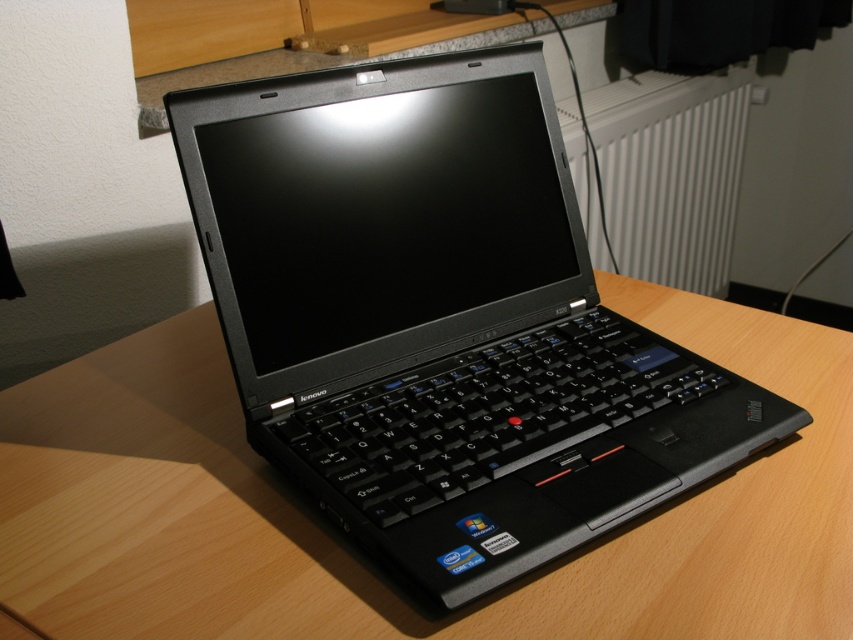
Question: Considering the relative positions of black plastic laptop at center and white plastic radiator at upper center in the image provided, where is black plastic laptop at center located with respect to white plastic radiator at upper center?

Choices:
 (A) left
 (B) right

Answer: (A)

Question: Is wooden table at center wider than white plastic radiator at upper center?

Choices:
 (A) no
 (B) yes

Answer: (B)

Question: Which point is closer to the camera?

Choices:
 (A) wooden table at center
 (B) black plastic laptop at center
 (C) white plastic radiator at upper center

Answer: (B)

Question: Which point is closer to the camera taking this photo?

Choices:
 (A) (558, 289)
 (B) (113, 392)

Answer: (B)

Question: Which point is closer to the camera?

Choices:
 (A) black plastic laptop at center
 (B) white plastic radiator at upper center
 (C) wooden table at center

Answer: (A)

Question: Is black plastic laptop at center thinner than wooden table at center?

Choices:
 (A) no
 (B) yes

Answer: (B)